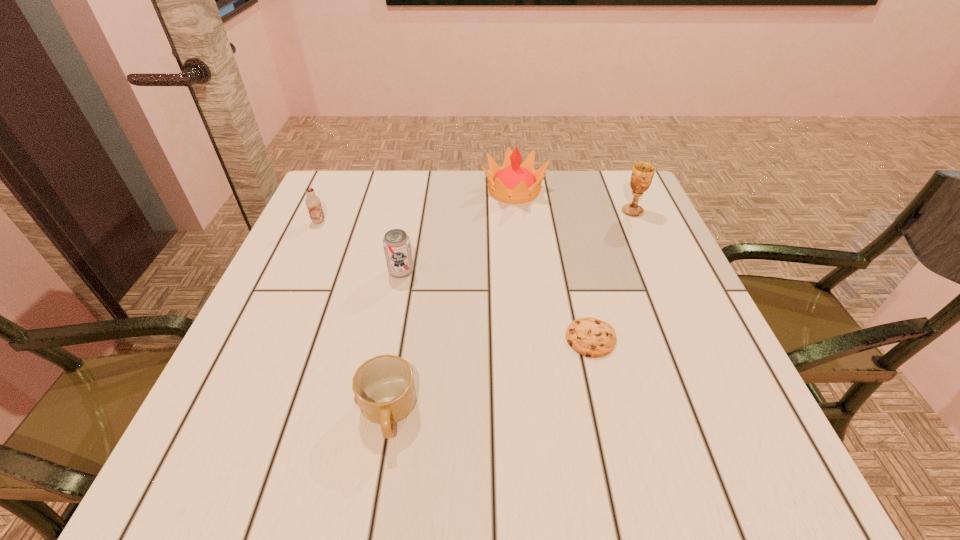
Image resolution: width=960 pixels, height=540 pixels. What are the coordinates of `blank space located on the back of the chalice` in the screenshot? It's located at (618, 179).

Identify the location of vacant space situated on the right of the third nearest object. Image resolution: width=960 pixels, height=540 pixels. (545, 272).

The height and width of the screenshot is (540, 960). In order to click on free space located 0.080m on the front of the third farthest object in this screenshot , I will do `click(308, 246)`.

In order to click on vacant region located on the back of the shortest object in this screenshot , I will do `click(578, 284)`.

At what (x,y) coordinates should I click in order to perform the action: click on crown positioned at the far edge. Please return your answer as a coordinate pair (x, y). The image size is (960, 540). Looking at the image, I should click on (512, 183).

You are a GUI agent. You are given a task and a screenshot of the screen. Output one action in this format:
    pyautogui.click(x=<x>, y=<y>)
    Task: Click on the chalice located at the far edge
    
    Given the screenshot: What is the action you would take?
    pyautogui.click(x=642, y=174)

You are a GUI agent. You are given a task and a screenshot of the screen. Output one action in this format:
    pyautogui.click(x=<x>, y=<y>)
    Task: Click on the chocolate milk that is at the far edge
    This screenshot has height=540, width=960.
    Given the screenshot: What is the action you would take?
    pyautogui.click(x=313, y=203)

You are a GUI agent. You are given a task and a screenshot of the screen. Output one action in this format:
    pyautogui.click(x=<x>, y=<y>)
    Task: Click on the object located at the near edge
    This screenshot has height=540, width=960.
    Given the screenshot: What is the action you would take?
    pyautogui.click(x=384, y=388)

Locate an element on the screen. object at the left edge is located at coordinates (313, 203).

The width and height of the screenshot is (960, 540). I want to click on object located in the right edge section of the desktop, so click(642, 174).